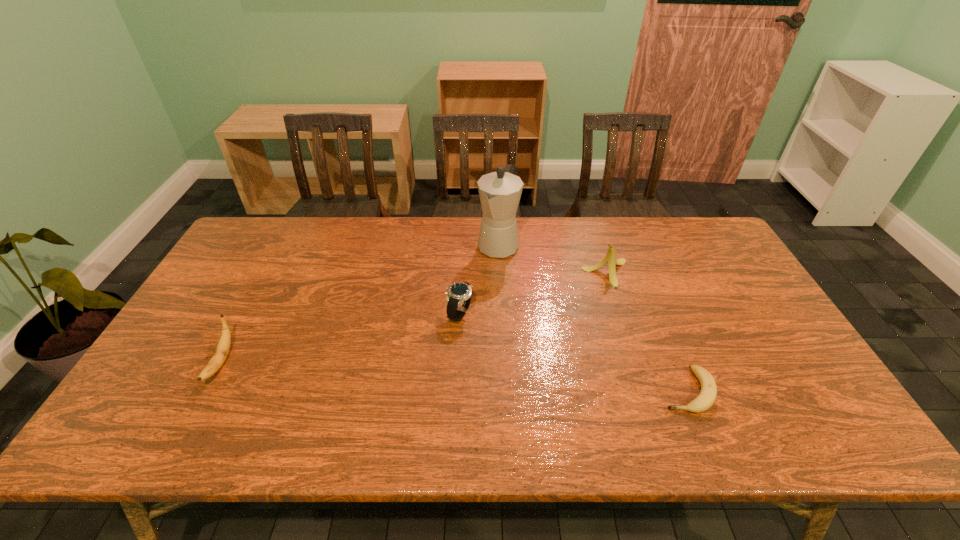
Identify the location of vacant region located 0.380m on the front of the tallest banana. The image size is (960, 540). (647, 399).

This screenshot has width=960, height=540. What are the coordinates of `vacant region located on the right of the third farthest object` in the screenshot? It's located at (518, 313).

You are a GUI agent. You are given a task and a screenshot of the screen. Output one action in this format:
    pyautogui.click(x=<x>, y=<y>)
    Task: Click on the vacant space located on the peel of the leftmost banana from the top
    The width and height of the screenshot is (960, 540).
    Given the screenshot: What is the action you would take?
    pyautogui.click(x=192, y=417)

Where is `vacant region located 0.140m on the back of the shortest object`? This screenshot has width=960, height=540. vacant region located 0.140m on the back of the shortest object is located at coordinates (660, 326).

I want to click on coffeepot present at the far edge, so click(500, 191).

Find the location of a particular element. banana located in the far edge section of the desktop is located at coordinates (610, 258).

In order to click on object that is positioned at the near edge in this screenshot , I will do `click(707, 396)`.

Identify the location of object at the left edge. This screenshot has width=960, height=540. (223, 346).

I want to click on free region at the far edge of the desktop, so click(x=662, y=254).

Locate an element on the screen. The width and height of the screenshot is (960, 540). vacant space at the near edge of the desktop is located at coordinates (348, 421).